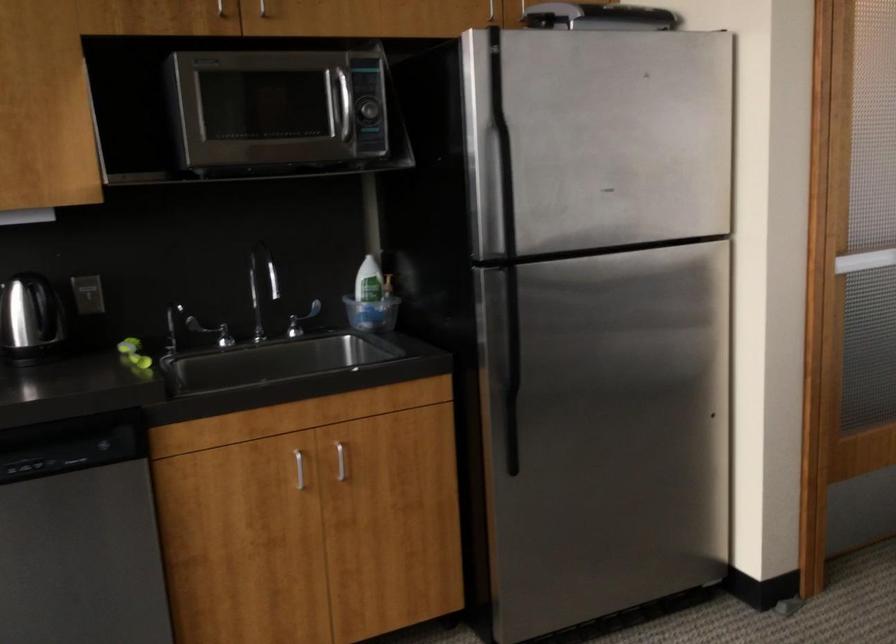
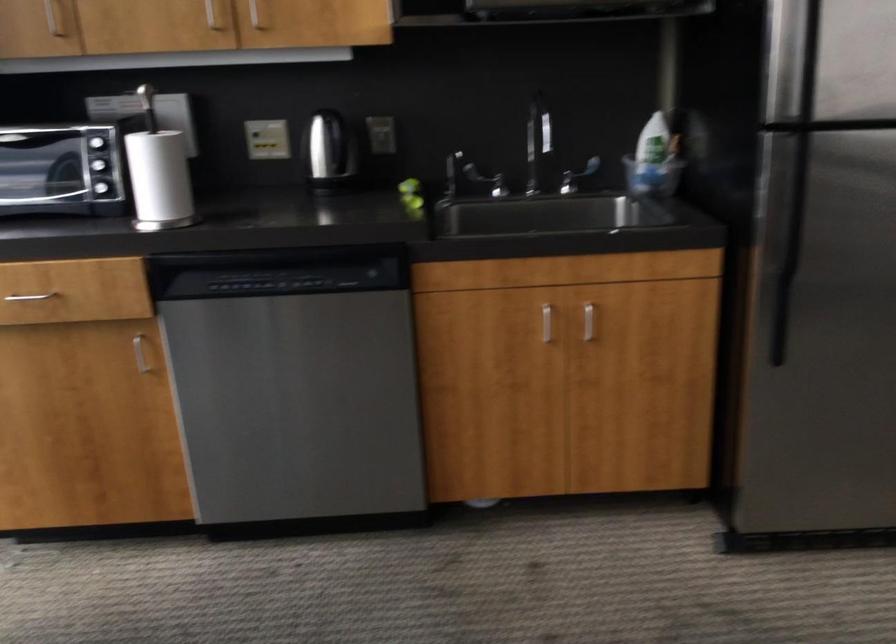
Where in the second image is the point corresponding to (364,296) from the first image?

(650, 155)